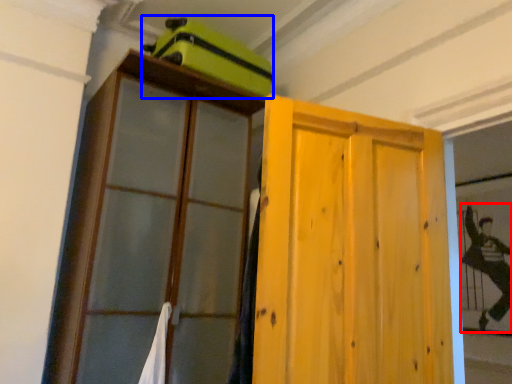
Question: Which object is further to the camera taking this photo, couple (highlighted by a red box) or luggage (highlighted by a blue box)?

Choices:
 (A) couple
 (B) luggage

Answer: (A)